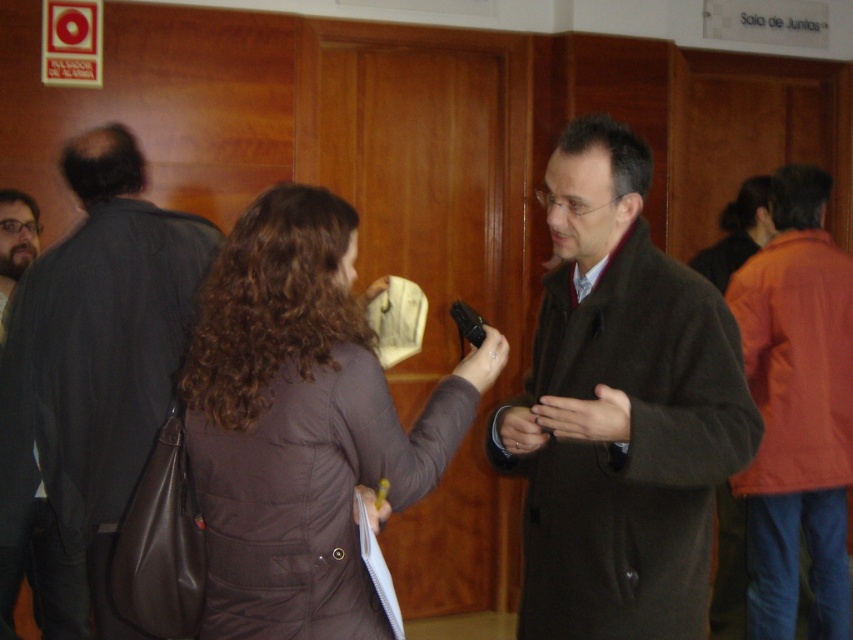
You are a security guard in the building and need to check the distance between the brown wool coat at center and the dark gray coat at left. The security protocol requires coats to be at least 1 meter apart for safety. Can you confirm if they meet the requirement?

The brown wool coat at center and dark gray coat at left are 1.02 meters apart from each other, which meets the security protocol requirement of being at least 1 meter apart.

You are a photographer setting up for a group photo in the conference room. You need to position the subjects so that the brown wool coat at center and the orange fabric jacket at right are visible. Based on their current positions, which subject should be placed on the left side of the photo to ensure both are visible?

The brown wool coat at center should be placed on the left side of the photo because it is already positioned to the left of the orange fabric jacket at right, ensuring both are visible in the frame.

You are standing in the conference room and need to locate the brown wool coat at center. According to the scene description, where exactly is it positioned?

The brown wool coat at center is located at point coordinates 0.644 on the x axis and 0.728 on the y axis.